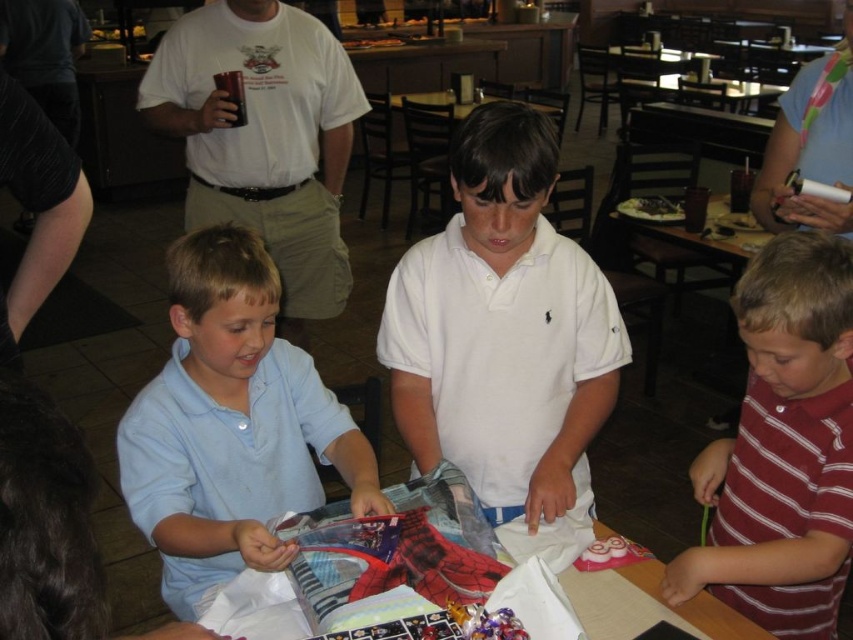
You are a photographer standing at the entrance of the restaurant. You need to take a photo of the white cotton shirt at center without moving any objects. Can you capture it in your current position?

Yes, the white cotton shirt at center is located at point (502,328) which is within the photographer s current field of view from the entrance.

You are standing at the center of the room. Which direction should you walk to reach the light blue cotton shirt at lower left?

Since the light blue cotton shirt at lower left is located at point 0.666 on the x and 0.272 on the y axis, you should walk towards the lower left direction to reach it.